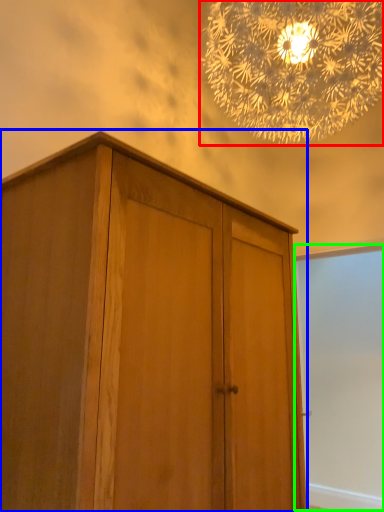
Question: Considering the real-world distances, which object is farthest from lamp (highlighted by a red box)? cupboard (highlighted by a blue box) or screen door (highlighted by a green box)?

Choices:
 (A) cupboard
 (B) screen door

Answer: (B)